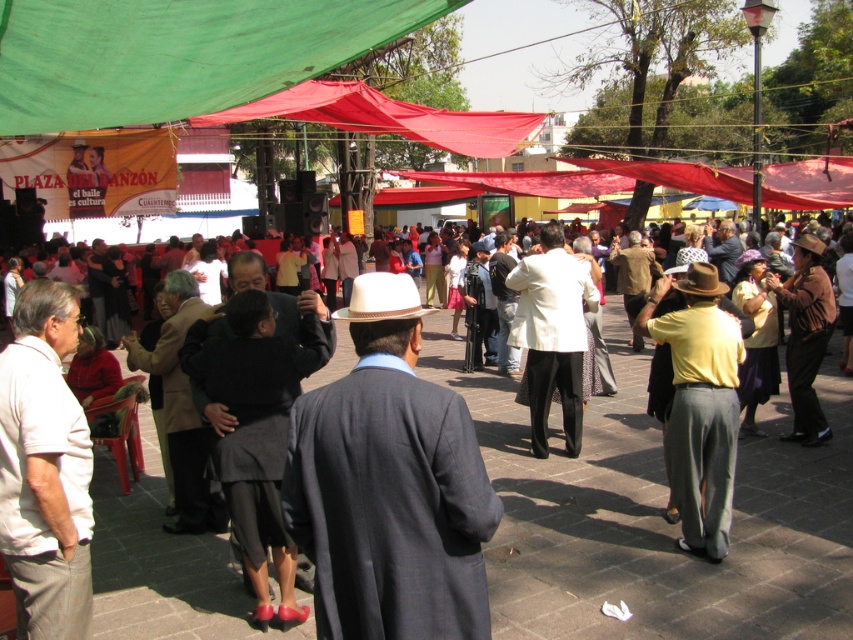
You are organizing a photo shoot and need to position the matte black suit at center and the white matte suit at center in the frame. According to the scene, which suit should be placed closer to the camera to maintain their relative sizes as seen in the original image?

The matte black suit at center is bigger than the white matte suit at center, so to maintain their relative sizes, the white matte suit at center should be placed closer to the camera than the matte black suit at center.